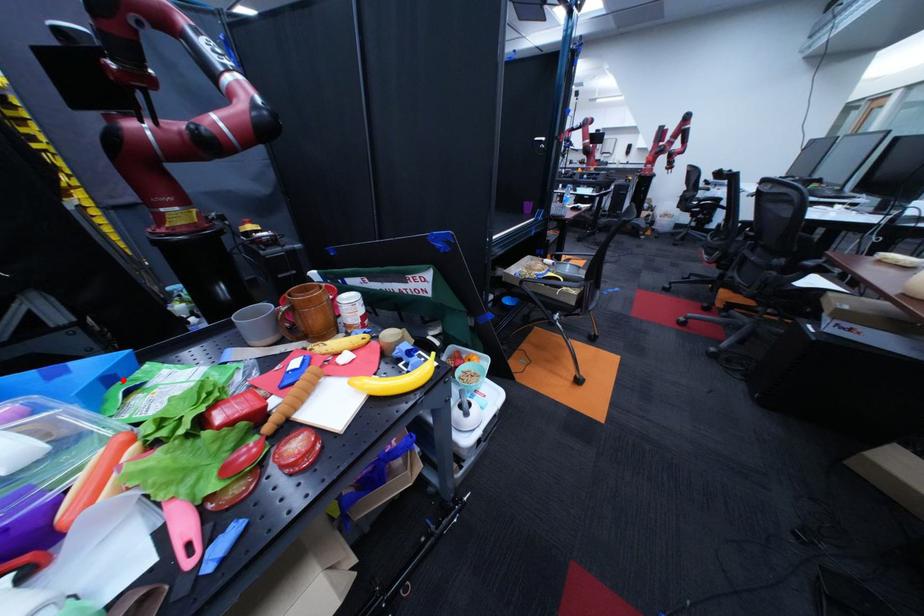
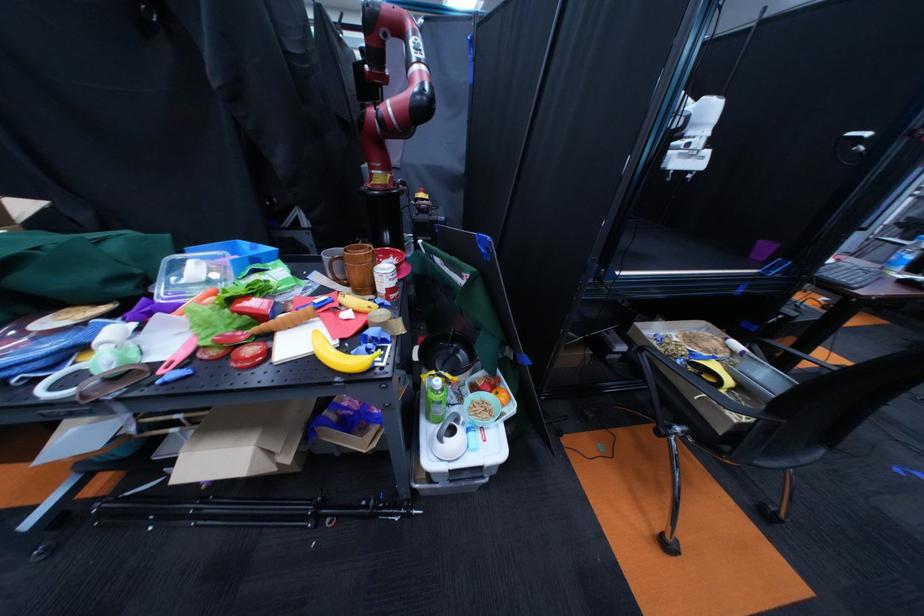
Locate, in the second image, the point that corresponds to the highlighted location in the first image.

(268, 261)